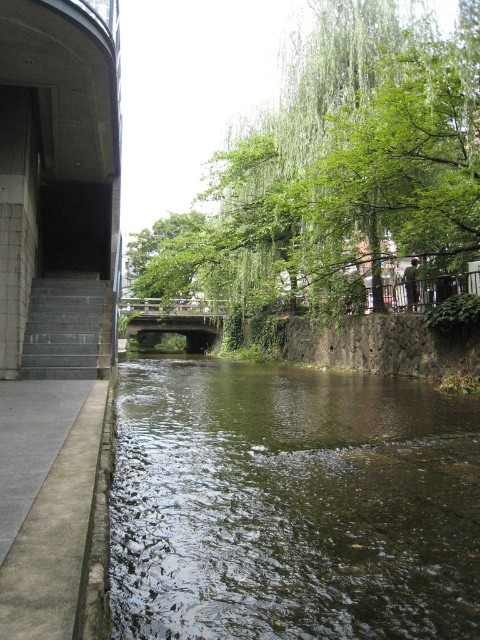
In the scene shown: Between green leafy tree at center and wooden bridge at center, which one appears on the left side from the viewer's perspective?

wooden bridge at center is more to the left.

This screenshot has width=480, height=640. What are the coordinates of `green leafy tree at center` in the screenshot? It's located at (336, 168).

Where is `green leafy tree at center`? green leafy tree at center is located at coordinates (336, 168).

Measure the distance between dark green water at center and green leafy tree at center.

dark green water at center and green leafy tree at center are 14.32 meters apart.

Does point (416, 492) come farther from viewer compared to point (453, 243)?

That is False.

The height and width of the screenshot is (640, 480). I want to click on dark green water at center, so 291,504.

The height and width of the screenshot is (640, 480). Find the location of `dark green water at center`. dark green water at center is located at coordinates (291, 504).

Does dark green water at center appear on the right side of gray concrete stairs at left?

Indeed, dark green water at center is positioned on the right side of gray concrete stairs at left.

Is point (180, 566) positioned behind point (54, 307)?

No.

In order to click on dark green water at center in this screenshot , I will do `click(291, 504)`.